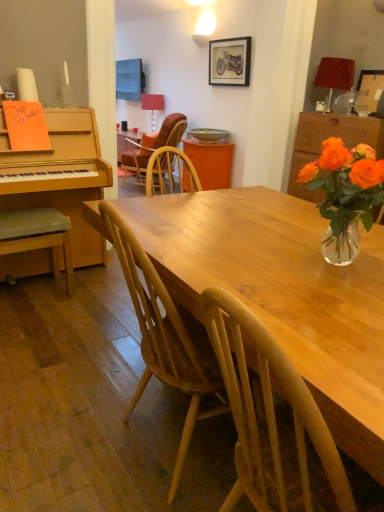
Question: Is light brown wooden table at center in front of wooden picture frame at upper center, arranged as the 2th picture frame when viewed from the front?

Choices:
 (A) no
 (B) yes

Answer: (B)

Question: Is light brown wooden table at center aimed at wooden picture frame at upper center, placed as the second picture frame when sorted from right to left?

Choices:
 (A) yes
 (B) no

Answer: (B)

Question: Is light brown wooden table at center wider than wooden picture frame at upper center, which is the 1th picture frame from back to front?

Choices:
 (A) no
 (B) yes

Answer: (B)

Question: Does light brown wooden table at center have a lesser height compared to wooden picture frame at upper center, the first picture frame viewed from the top?

Choices:
 (A) yes
 (B) no

Answer: (B)

Question: Is light brown wooden table at center to the left of wooden picture frame at upper center, placed as the second picture frame when sorted from right to left, from the viewer's perspective?

Choices:
 (A) yes
 (B) no

Answer: (A)

Question: Is light gray cushioned stool at left, which is counted as the first chair, starting from the front, in front of or behind translucent glass vase at upper right in the image?

Choices:
 (A) behind
 (B) front

Answer: (A)

Question: Choose the correct answer: Is light gray cushioned stool at left, placed as the second chair when sorted from top to bottom, inside translucent glass vase at upper right or outside it?

Choices:
 (A) outside
 (B) inside

Answer: (A)

Question: From a real-world perspective, relative to translucent glass vase at upper right, is light gray cushioned stool at left, acting as the second chair starting from the right, vertically above or below?

Choices:
 (A) below
 (B) above

Answer: (A)

Question: From the image's perspective, is light gray cushioned stool at left, which is counted as the first chair, starting from the front, positioned above or below translucent glass vase at upper right?

Choices:
 (A) above
 (B) below

Answer: (B)

Question: Relative to matte red lampshade at upper center, marked as the 1th lamp in a left-to-right arrangement, is translucent glass vase at upper right, placed as the 2th cabinetry when sorted from back to front, in front or behind?

Choices:
 (A) behind
 (B) front

Answer: (B)

Question: From the image's perspective, is translucent glass vase at upper right, placed as the 2th cabinetry when sorted from back to front, above or below matte red lampshade at upper center, the first lamp positioned from the back?

Choices:
 (A) below
 (B) above

Answer: (A)

Question: Is point (x=349, y=123) positioned closer to the camera than point (x=150, y=96)?

Choices:
 (A) closer
 (B) farther

Answer: (A)

Question: Is translucent glass vase at upper right, acting as the first cabinetry starting from the front, spatially inside matte red lampshade at upper center, marked as the 1th lamp in a left-to-right arrangement, or outside of it?

Choices:
 (A) inside
 (B) outside

Answer: (B)

Question: From a real-world perspective, is light brown wooden table at center physically located above or below translucent glass vase at upper right, the second cabinetry when ordered from left to right?

Choices:
 (A) below
 (B) above

Answer: (A)

Question: Does point (256, 244) appear closer or farther from the camera than point (289, 181)?

Choices:
 (A) closer
 (B) farther

Answer: (A)